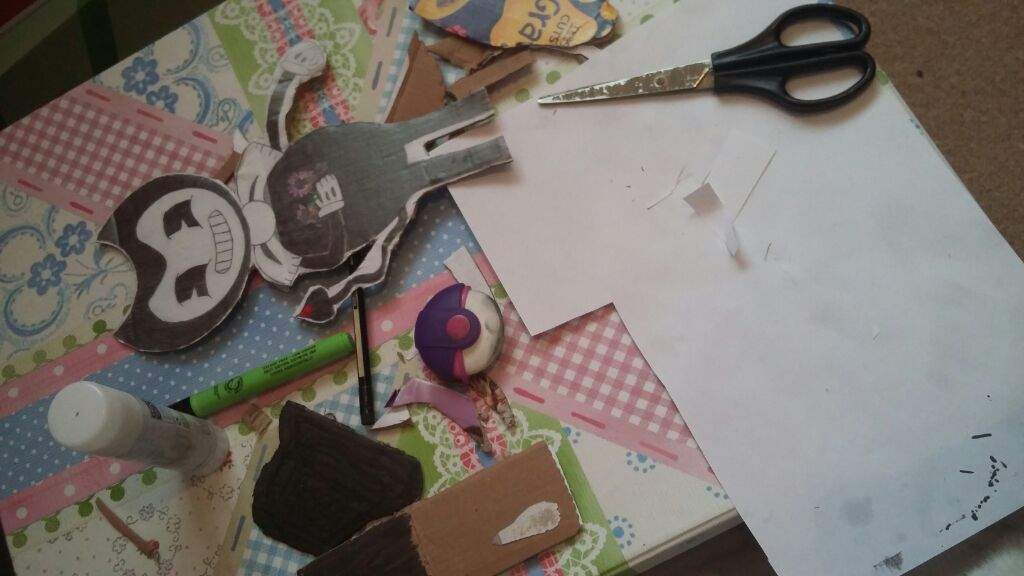
Image resolution: width=1024 pixels, height=576 pixels. Identify the location of marker. (262, 380).